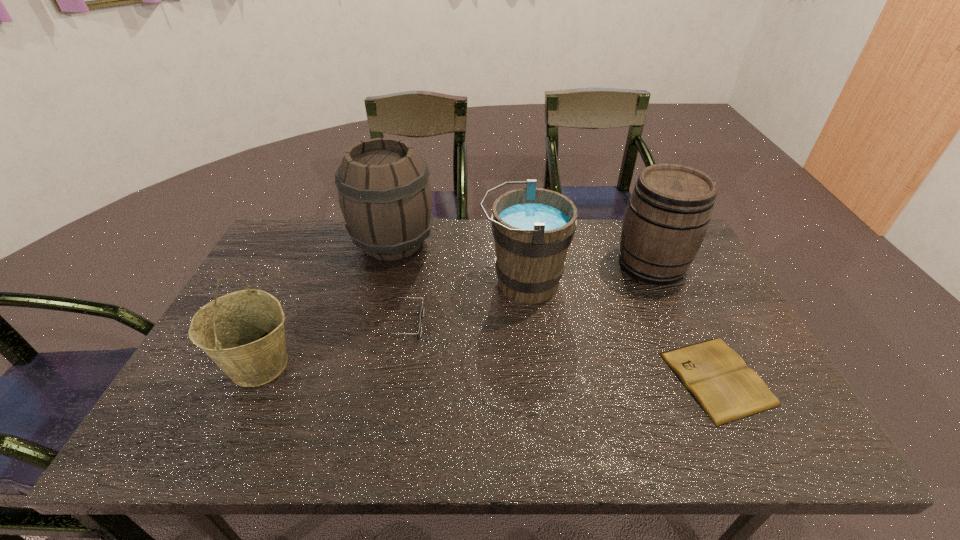
You are a GUI agent. You are given a task and a screenshot of the screen. Output one action in this format:
    pyautogui.click(x=<x>, y=<y>)
    Task: Click on the free point that satisfies the following two spatial constraints: 1. with a handle on the side of the shortest object; 2. on the right side of the third wine bucket from left to right
    
    Given the screenshot: What is the action you would take?
    pyautogui.click(x=534, y=379)

Find the location of a particular element. Image resolution: width=960 pixels, height=540 pixels. vacant area that satisfies the following two spatial constraints: 1. with a handle on the side of the shortest object; 2. on the left side of the third wine bucket from left to right is located at coordinates click(534, 379).

Find the location of a particular element. The image size is (960, 540). vacant space that satisfies the following two spatial constraints: 1. on the front side of the rightmost wine bucket; 2. on the front-facing side of the sunglasses is located at coordinates (679, 323).